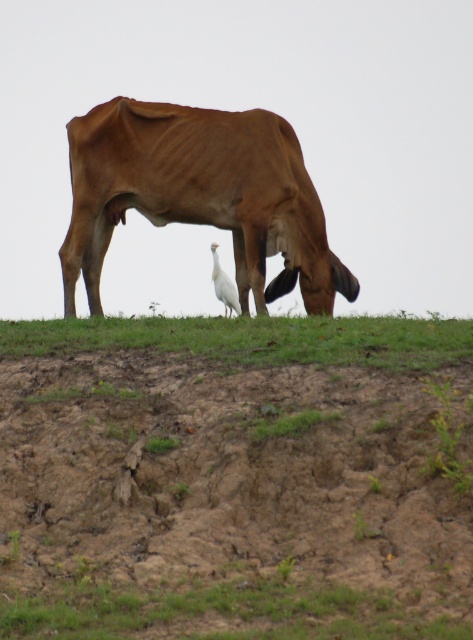
Can you confirm if brown glossy cow at center is thinner than white smooth bird at center?

In fact, brown glossy cow at center might be wider than white smooth bird at center.

Which is in front, point (171, 125) or point (238, 310)?

Point (171, 125)

Is point (130, 161) behind point (219, 282)?

No, (130, 161) is in front of (219, 282).

The width and height of the screenshot is (473, 640). I want to click on brown glossy cow at center, so click(x=200, y=195).

Which is above, brown glossy cow at center or green grass at lower center?

Positioned higher is brown glossy cow at center.

Is point (329, 256) closer to viewer compared to point (210, 342)?

No, it is behind (210, 342).

Does point (183, 122) come behind point (253, 344)?

Yes.

Locate an element on the screen. The image size is (473, 640). brown glossy cow at center is located at coordinates (200, 195).

The width and height of the screenshot is (473, 640). What do you see at coordinates (254, 339) in the screenshot?
I see `green grass at lower center` at bounding box center [254, 339].

Is point (253, 328) positioned in front of point (217, 275)?

Yes, it is in front of point (217, 275).

What do you see at coordinates (254, 339) in the screenshot? This screenshot has width=473, height=640. I see `green grass at lower center` at bounding box center [254, 339].

The width and height of the screenshot is (473, 640). In order to click on green grass at lower center in this screenshot , I will do `click(254, 339)`.